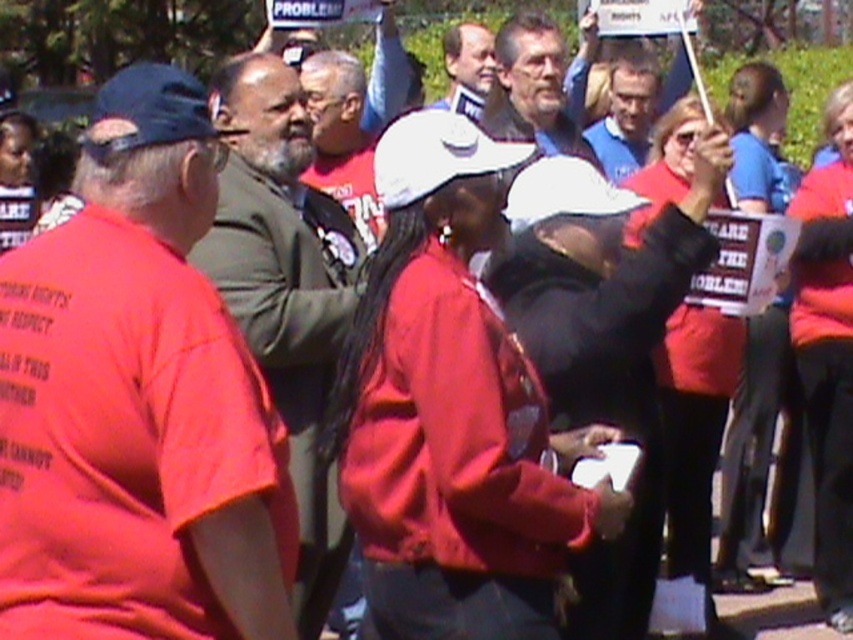
Is matte orange t-shirt at left taller than gray hair at center?

Yes, matte orange t-shirt at left is taller than gray hair at center.

Which is behind, point (103, 504) or point (485, 124)?

Positioned behind is point (485, 124).

What do you see at coordinates (136, 403) in the screenshot? Image resolution: width=853 pixels, height=640 pixels. I see `matte orange t-shirt at left` at bounding box center [136, 403].

This screenshot has width=853, height=640. Find the location of `matte orange t-shirt at left`. matte orange t-shirt at left is located at coordinates (136, 403).

Who is more distant from viewer, (239, 58) or (651, 68)?

Point (651, 68)

Is green textured jacket at center to the left of blue fabric shirt at upper center from the viewer's perspective?

Indeed, green textured jacket at center is positioned on the left side of blue fabric shirt at upper center.

Which is behind, point (277, 369) or point (624, 138)?

Positioned behind is point (624, 138).

I want to click on green textured jacket at center, so click(286, 291).

Which of these two, matte red jacket at center or gray hair at center, stands shorter?

With less height is gray hair at center.

Is point (363, 547) positioned before point (496, 42)?

That is True.

Where is `matte red jacket at center`? This screenshot has height=640, width=853. matte red jacket at center is located at coordinates (450, 410).